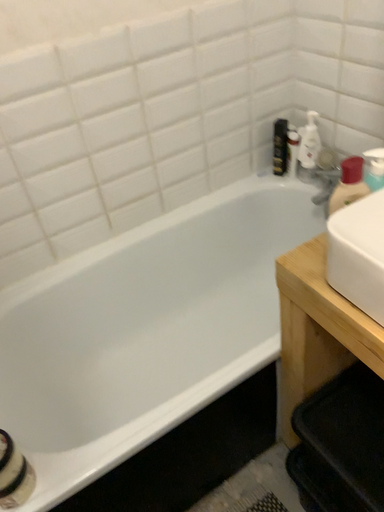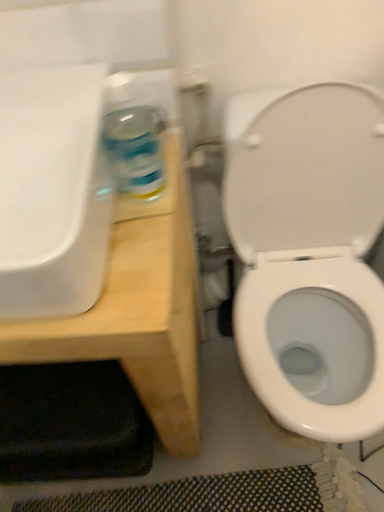
Question: How did the camera likely rotate when shooting the video?

Choices:
 (A) rotated upward
 (B) rotated downward

Answer: (A)